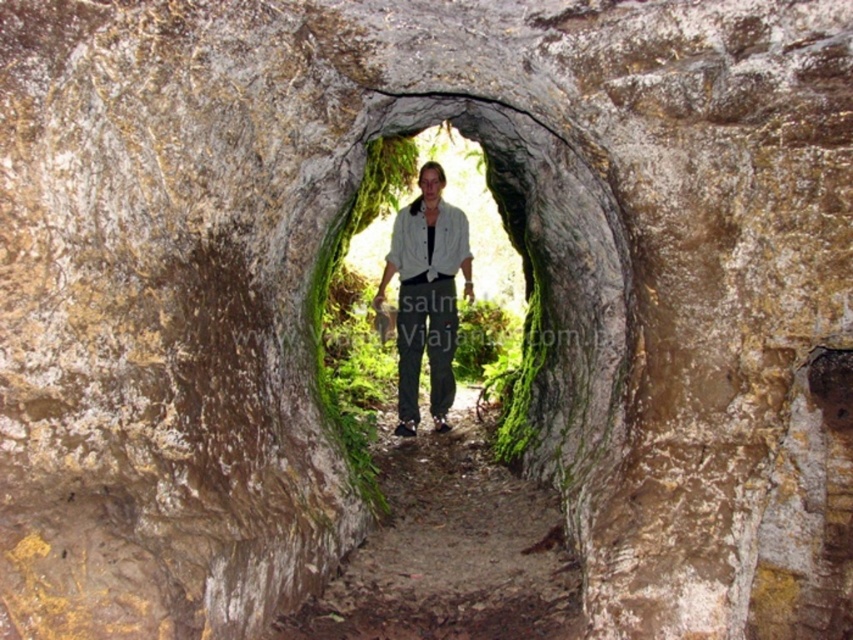
Question: Estimate the real-world distances between objects in this image. Which object is closer to the dirt path at center?

Choices:
 (A) light gray shirt at center
 (B) green mossy rock at center

Answer: (B)

Question: Which of the following is the closest to the observer?

Choices:
 (A) green mossy rock at center
 (B) light gray shirt at center
 (C) dirt path at center

Answer: (A)

Question: Does dirt path at center have a smaller size compared to light gray shirt at center?

Choices:
 (A) yes
 (B) no

Answer: (A)

Question: Estimate the real-world distances between objects in this image. Which object is closer to the green mossy rock at center?

Choices:
 (A) light gray shirt at center
 (B) dirt path at center

Answer: (B)

Question: Does dirt path at center appear over light gray shirt at center?

Choices:
 (A) yes
 (B) no

Answer: (B)

Question: Does dirt path at center lie in front of light gray shirt at center?

Choices:
 (A) no
 (B) yes

Answer: (B)